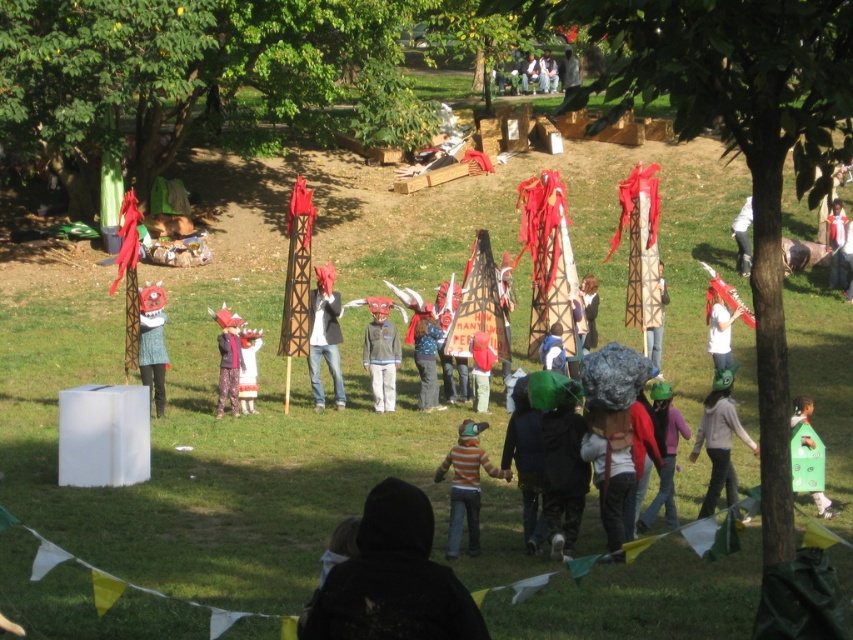
Question: Is gray matte jacket at center wider than matte pink fabric at center?

Choices:
 (A) no
 (B) yes

Answer: (B)

Question: Which point is closer to the camera?

Choices:
 (A) (737, 232)
 (B) (245, 384)

Answer: (B)

Question: Which object is farther from the camera taking this photo?

Choices:
 (A) green fabric costume at lower right
 (B) gray matte jacket at center
 (C) green fabric headpiece at center

Answer: (B)

Question: Does knitted sweater at center lie behind green fabric costume at lower right?

Choices:
 (A) no
 (B) yes

Answer: (B)

Question: Which of the following is the closest to the observer?

Choices:
 (A) (706, 513)
 (B) (154, 314)
 (C) (726, 332)

Answer: (A)

Question: Does striped cotton shirt at center have a lesser width compared to gray matte jacket at center?

Choices:
 (A) no
 (B) yes

Answer: (A)